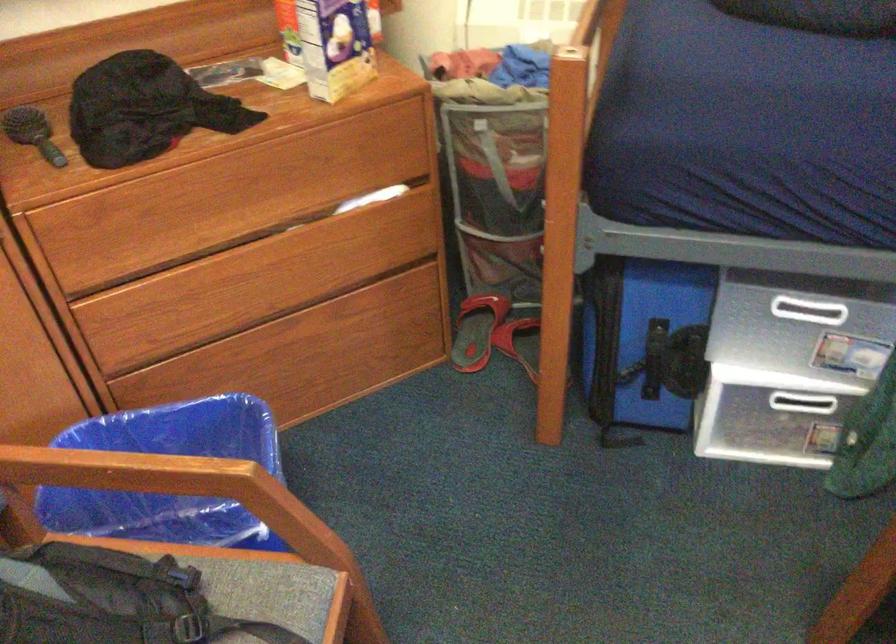
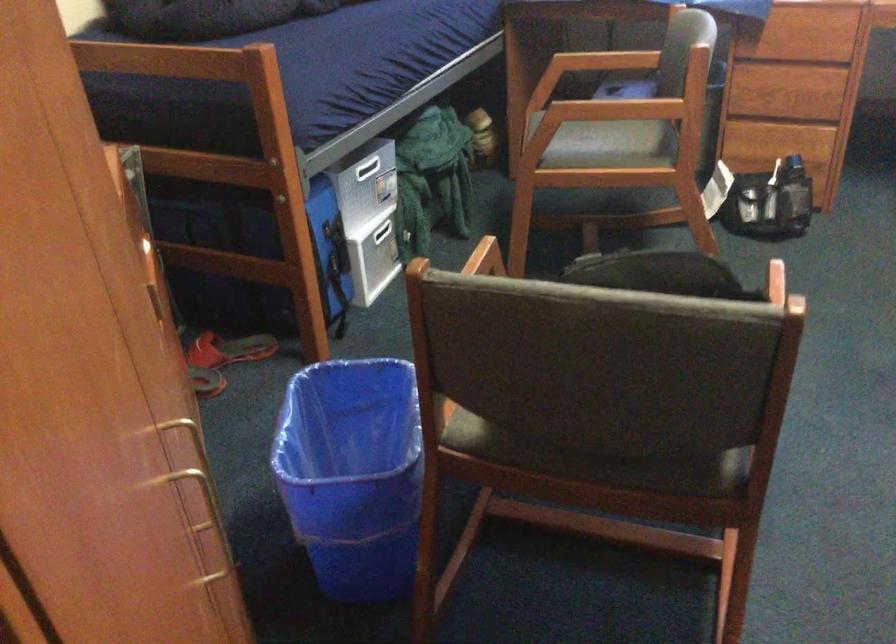
Find the pixel in the second image that matches (817,406) in the first image.

(383, 231)